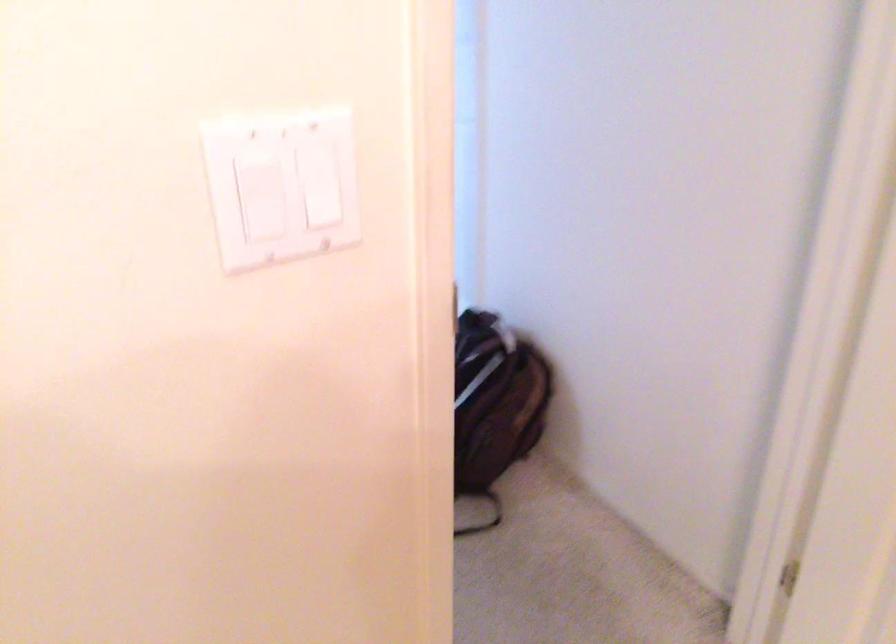
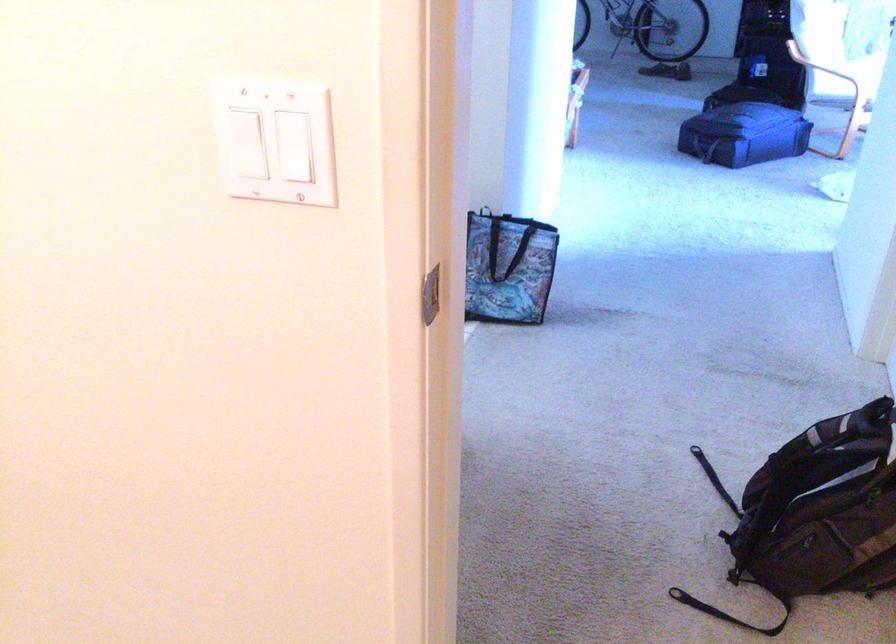
Locate, in the second image, the point that corresponds to the point at 277,223 in the first image.

(242, 143)